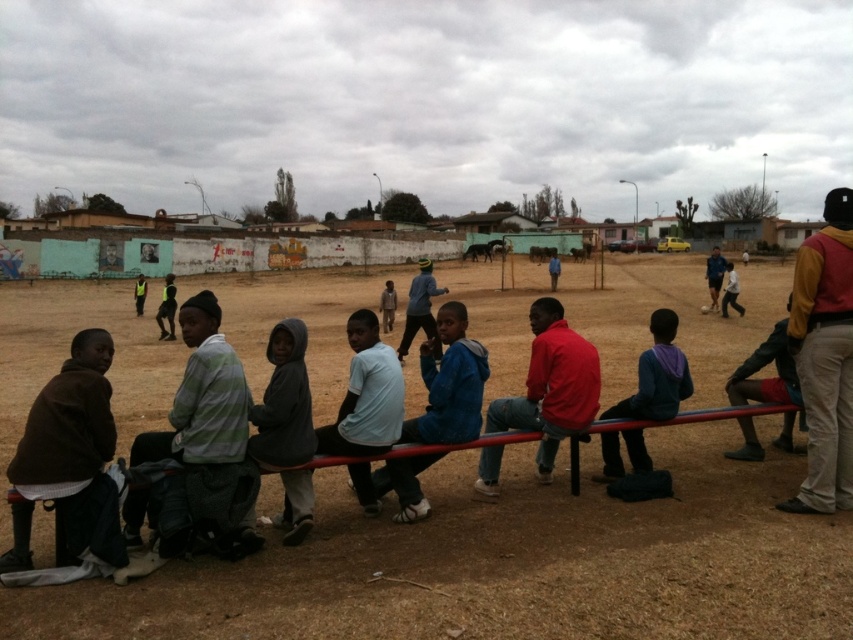
Can you confirm if striped fabric jacket at center is positioned to the right of red matte shirt at center?

In fact, striped fabric jacket at center is to the left of red matte shirt at center.

Locate an element on the screen. Image resolution: width=853 pixels, height=640 pixels. striped fabric jacket at center is located at coordinates pyautogui.click(x=202, y=396).

Identify the location of striped fabric jacket at center. This screenshot has height=640, width=853. (202, 396).

Measure the distance between point (793,554) and camera.

The distance of point (793,554) from camera is 4.11 meters.

Does brown dirt field at center have a smaller size compared to striped fabric jacket at center?

No.

Is point (550, 518) behind point (142, 508)?

Yes, it is.

In order to click on brown dirt field at center in this screenshot , I will do `click(508, 561)`.

What do you see at coordinates (202, 396) in the screenshot? I see `striped fabric jacket at center` at bounding box center [202, 396].

Does point (236, 388) come closer to viewer compared to point (726, 269)?

Yes, point (236, 388) is in front of point (726, 269).

Which is in front, point (175, 452) or point (723, 296)?

Point (175, 452) is in front.

Find the location of a particular element. Image resolution: width=853 pixels, height=640 pixels. striped fabric jacket at center is located at coordinates (202, 396).